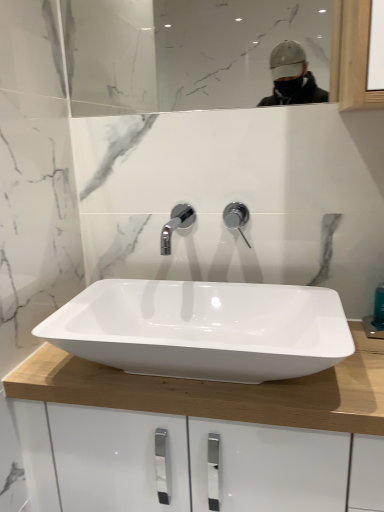
Question: Considering their positions, is white glossy sink at center located in front of or behind polished chrome tap at center?

Choices:
 (A) front
 (B) behind

Answer: (A)

Question: Is white glossy sink at center taller or shorter than polished chrome tap at center?

Choices:
 (A) tall
 (B) short

Answer: (B)

Question: Which object is positioned farthest from the white glossy sink at center?

Choices:
 (A) polished chrome tap at center
 (B) clear glass mirror at upper center

Answer: (B)

Question: Which of these objects is positioned closest to the clear glass mirror at upper center?

Choices:
 (A) polished chrome tap at center
 (B) white glossy sink at center

Answer: (B)